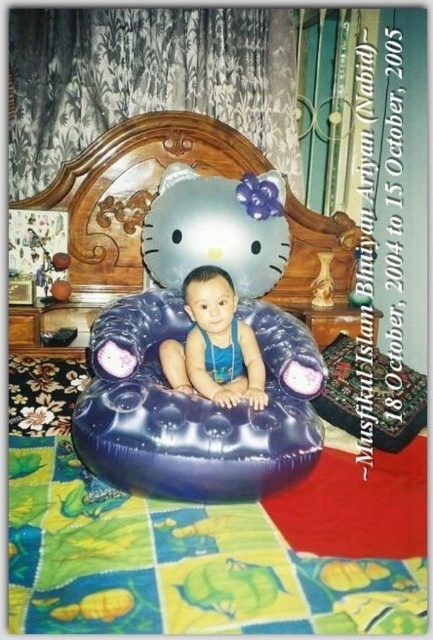
Question: Among these points, which one is nearest to the camera?

Choices:
 (A) (216, 410)
 (B) (187, 308)

Answer: (A)

Question: Is blue rubber bean bag chair at center to the left of blue rubber baby at center from the viewer's perspective?

Choices:
 (A) yes
 (B) no

Answer: (A)

Question: Does blue rubber bean bag chair at center have a greater width compared to blue rubber baby at center?

Choices:
 (A) no
 (B) yes

Answer: (B)

Question: Where is blue rubber bean bag chair at center located in relation to blue rubber baby at center in the image?

Choices:
 (A) left
 (B) right

Answer: (A)

Question: Which point is farther to the camera?

Choices:
 (A) blue rubber baby at center
 (B) blue rubber bean bag chair at center

Answer: (A)